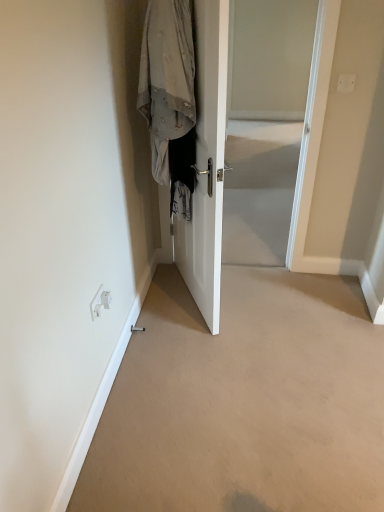
Question: Is white glossy door at center far from beige carpet at lower center?

Choices:
 (A) no
 (B) yes

Answer: (A)

Question: Is white glossy door at center to the right of beige carpet at lower center from the viewer's perspective?

Choices:
 (A) no
 (B) yes

Answer: (A)

Question: From the image's perspective, is white glossy door at center located beneath beige carpet at lower center?

Choices:
 (A) yes
 (B) no

Answer: (B)

Question: Could you tell me if white glossy door at center is turned towards beige carpet at lower center?

Choices:
 (A) no
 (B) yes

Answer: (A)

Question: Is white glossy door at center at the left side of beige carpet at lower center?

Choices:
 (A) yes
 (B) no

Answer: (A)

Question: From a real-world perspective, is transparent glass door at center positioned above or below white glossy door at center?

Choices:
 (A) below
 (B) above

Answer: (A)

Question: From the image's perspective, relative to white glossy door at center, is transparent glass door at center above or below?

Choices:
 (A) below
 (B) above

Answer: (B)

Question: Is transparent glass door at center wider or thinner than white glossy door at center?

Choices:
 (A) thin
 (B) wide

Answer: (B)

Question: From their relative heights in the image, would you say transparent glass door at center is taller or shorter than white glossy door at center?

Choices:
 (A) short
 (B) tall

Answer: (A)

Question: From the image's perspective, is white glossy door at center located above or below light gray fabric coat at center?

Choices:
 (A) above
 (B) below

Answer: (B)

Question: Is white glossy door at center taller or shorter than light gray fabric coat at center?

Choices:
 (A) short
 (B) tall

Answer: (B)

Question: Is white glossy door at center wider or thinner than light gray fabric coat at center?

Choices:
 (A) wide
 (B) thin

Answer: (B)

Question: Which is correct: white glossy door at center is inside light gray fabric coat at center, or outside of it?

Choices:
 (A) outside
 (B) inside

Answer: (A)

Question: From the image's perspective, is white glossy door at center located above or below transparent glass door at center?

Choices:
 (A) below
 (B) above

Answer: (A)

Question: In the image, is white glossy door at center positioned in front of or behind transparent glass door at center?

Choices:
 (A) front
 (B) behind

Answer: (A)